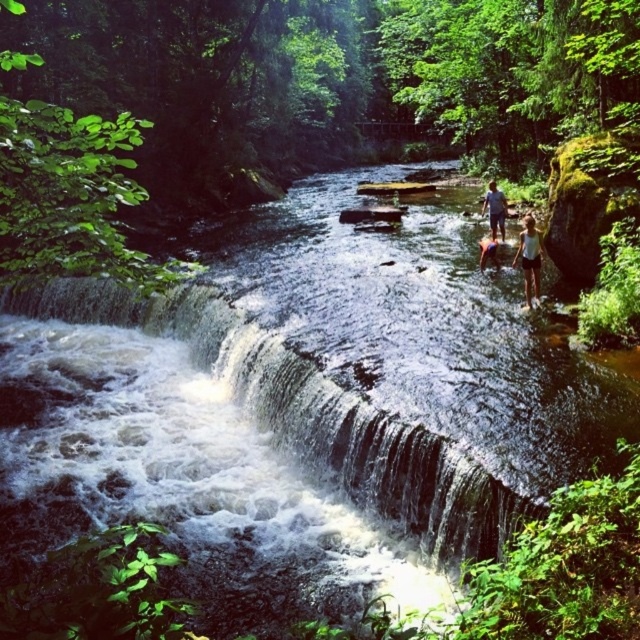
Question: Which point appears farthest from the camera in this image?

Choices:
 (A) pos(497,260)
 (B) pos(536,272)
 (C) pos(497,220)

Answer: (C)

Question: Is brown fabric shorts at center above orange life vest at center?

Choices:
 (A) yes
 (B) no

Answer: (A)

Question: Which point is farther to the camera?

Choices:
 (A) orange life vest at center
 (B) brown fabric shorts at center
 (C) white cotton tank top at center

Answer: (B)

Question: Can you confirm if white cotton tank top at center is positioned above brown fabric shorts at center?

Choices:
 (A) no
 (B) yes

Answer: (A)

Question: Does brown fabric shorts at center appear over orange life vest at center?

Choices:
 (A) no
 (B) yes

Answer: (B)

Question: Among these points, which one is nearest to the camera?

Choices:
 (A) (481, 250)
 (B) (534, 236)

Answer: (B)